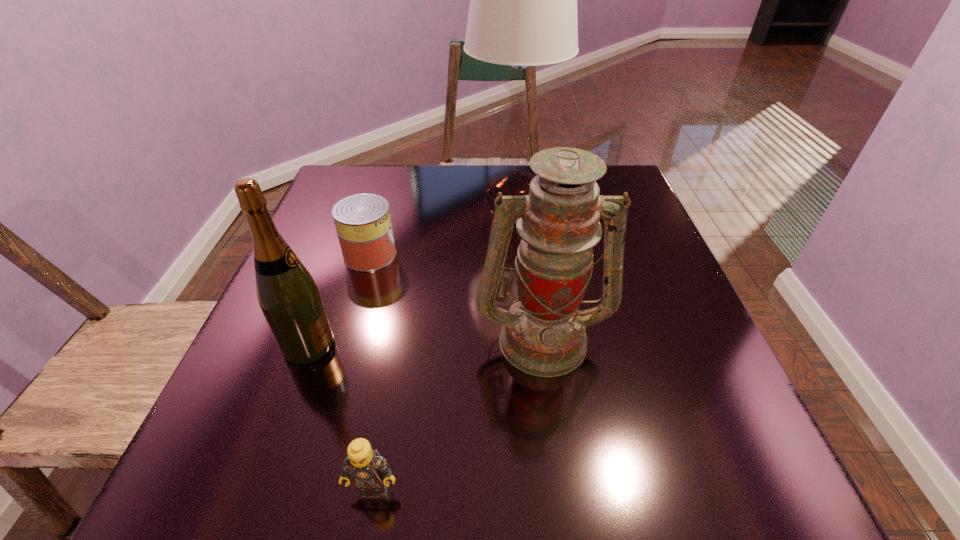
Find the location of a particular element. This screenshot has height=540, width=960. vacant area located on the right of the second farthest object is located at coordinates (454, 255).

This screenshot has width=960, height=540. In order to click on object that is at the far edge in this screenshot , I will do `click(523, 0)`.

Where is `object that is at the near edge`? object that is at the near edge is located at coordinates (369, 472).

At what (x,y) coordinates should I click in order to perform the action: click on wine bottle located in the left edge section of the desktop. Please return your answer as a coordinate pair (x, y). Image resolution: width=960 pixels, height=540 pixels. Looking at the image, I should click on (288, 296).

You are a GUI agent. You are given a task and a screenshot of the screen. Output one action in this format:
    pyautogui.click(x=<x>, y=<y>)
    Task: Click on the can situated at the left edge
    This screenshot has height=540, width=960.
    Given the screenshot: What is the action you would take?
    pyautogui.click(x=363, y=223)

Find the location of a particular element. The width and height of the screenshot is (960, 540). vacant region at the far edge of the desktop is located at coordinates [x=468, y=165].

I want to click on vacant area at the near edge, so click(544, 514).

The height and width of the screenshot is (540, 960). Find the location of `vacant space at the left edge of the desktop`. vacant space at the left edge of the desktop is located at coordinates (298, 416).

The height and width of the screenshot is (540, 960). Find the location of `free space at the right edge of the desktop`. free space at the right edge of the desktop is located at coordinates (684, 436).

The image size is (960, 540). I want to click on vacant space at the far left corner, so click(x=343, y=194).